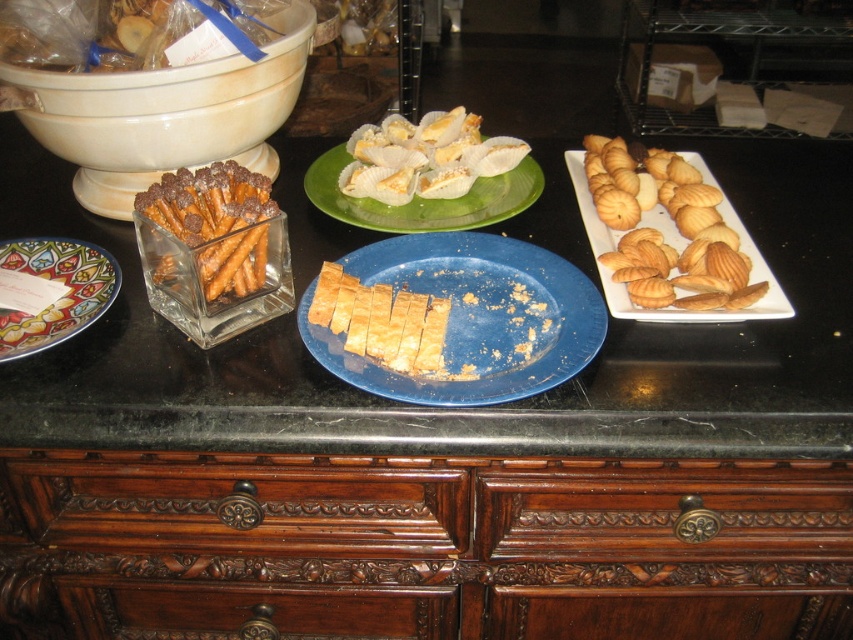
Question: Which of the following is the closest to the observer?

Choices:
 (A) decorative ceramic plate at lower left
 (B) translucent glass pretzels at left

Answer: (B)

Question: Considering the real-world distances, which object is farthest from the green matte plate at center?

Choices:
 (A) blue matte plate at center
 (B) golden crisp pastry at center
 (C) golden crispy cookies at right

Answer: (C)

Question: Which of the following is the closest to the observer?

Choices:
 (A) (434, 134)
 (B) (746, 596)

Answer: (B)

Question: Is golden crispy pastry at center above green matte plate at center?

Choices:
 (A) yes
 (B) no

Answer: (B)

Question: Is golden crispy pastry at center to the left of green matte plate at center from the viewer's perspective?

Choices:
 (A) yes
 (B) no

Answer: (A)

Question: Does golden crispy cookies at right have a greater width compared to golden crispy pastry at center?

Choices:
 (A) no
 (B) yes

Answer: (B)